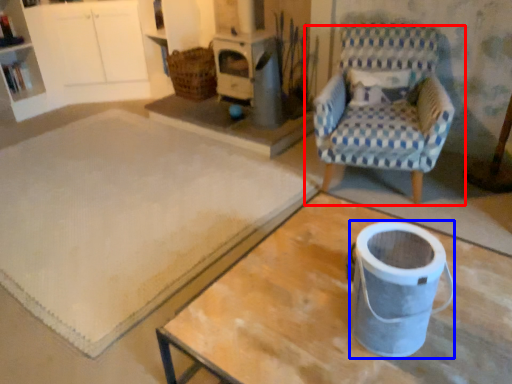
Question: Among these objects, which one is farthest to the camera, chair (highlighted by a red box) or appliance (highlighted by a blue box)?

Choices:
 (A) chair
 (B) appliance

Answer: (A)